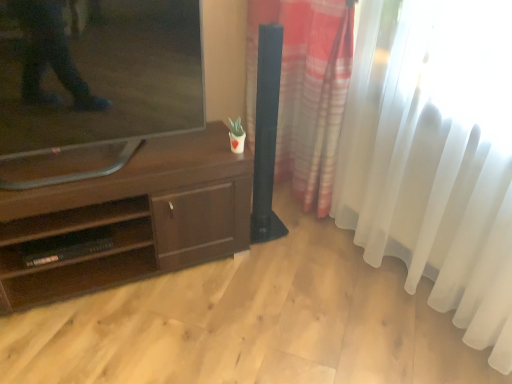
I want to click on free space to the right of dark brown wood tv stand at center, so click(x=276, y=294).